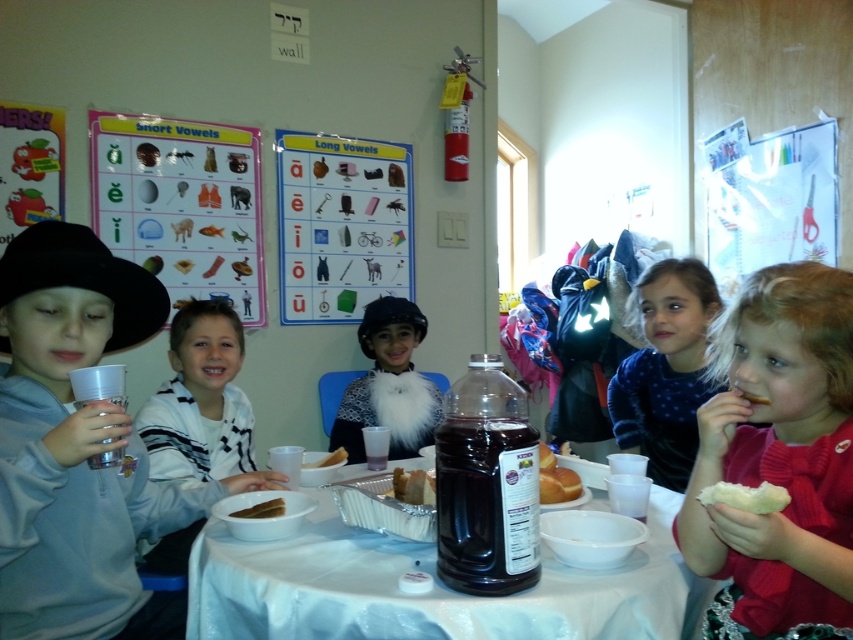
Based on the photo, which of these two, red sweater at lower right or white paper plate at center, stands taller?

Standing taller between the two is red sweater at lower right.

Does red sweater at lower right have a lesser width compared to white paper plate at center?

Incorrect, red sweater at lower right's width is not less than white paper plate at center's.

Where is `red sweater at lower right`? red sweater at lower right is located at coordinates (778, 458).

Is point (24, 554) positioned before point (132, 243)?

Yes, it is.

Who is positioned more to the left, gray fleece jacket at left or paperboard poster at upper center?

Positioned to the left is paperboard poster at upper center.

Find the location of a particular element. gray fleece jacket at left is located at coordinates (79, 448).

The width and height of the screenshot is (853, 640). Identify the location of gray fleece jacket at left. (79, 448).

Can you confirm if red sweater at lower right is shorter than white striped shirt at center?

Indeed, red sweater at lower right has a lesser height compared to white striped shirt at center.

Does red sweater at lower right appear over white striped shirt at center?

Yes, red sweater at lower right is above white striped shirt at center.

Identify the location of red sweater at lower right. (778, 458).

I want to click on red sweater at lower right, so click(x=778, y=458).